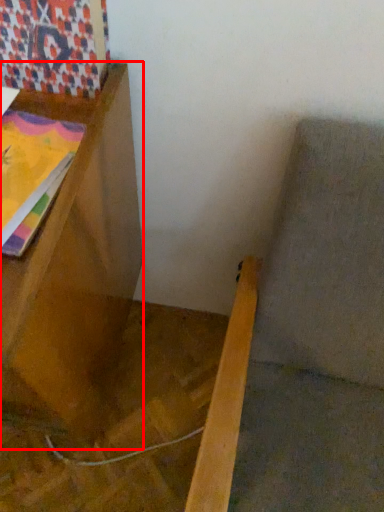
Question: From the image's perspective, what is the correct spatial positioning of furniture (annotated by the red box) in reference to tapestry?

Choices:
 (A) below
 (B) above

Answer: (A)